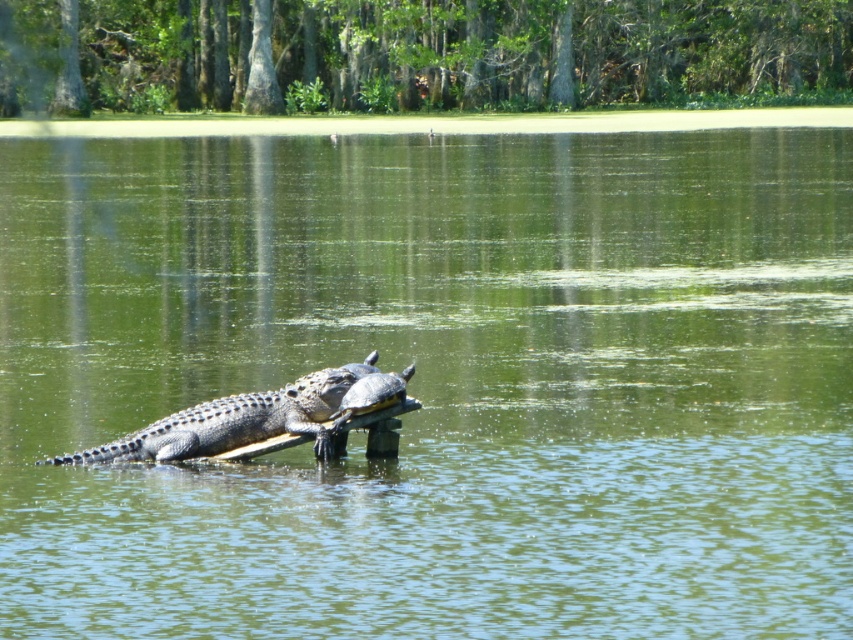
In the scene shown: You are a wildlife photographer aiming to capture both the leathery brown crocodile at center and the smooth gray crocodile at center in a single frame. Based on their widths, which crocodile would require you to adjust your camera angle to include its entire body in the shot?

The leathery brown crocodile at center might be wider than smooth gray crocodile at center, so you might need to adjust your camera angle to include its entire body in the shot.

You are a wildlife photographer aiming to capture the leathery brown crocodile at center in your shot. Your camera has a focus point at position 0.658, 0.277. Will the crocodile be in focus?

Yes, the leathery brown crocodile at center is exactly at the focus point (235, 420), so it will be in focus.

You are standing at the edge of the swamp and see the point marked at coordinates (235,420). What creature is located at that point?

The point at (235,420) indicates a leathery brown crocodile at center.